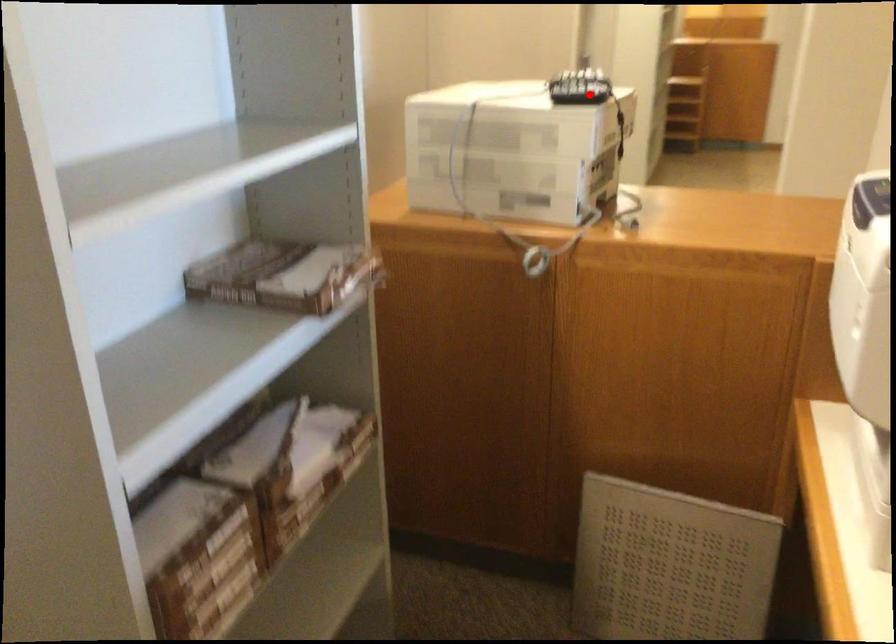
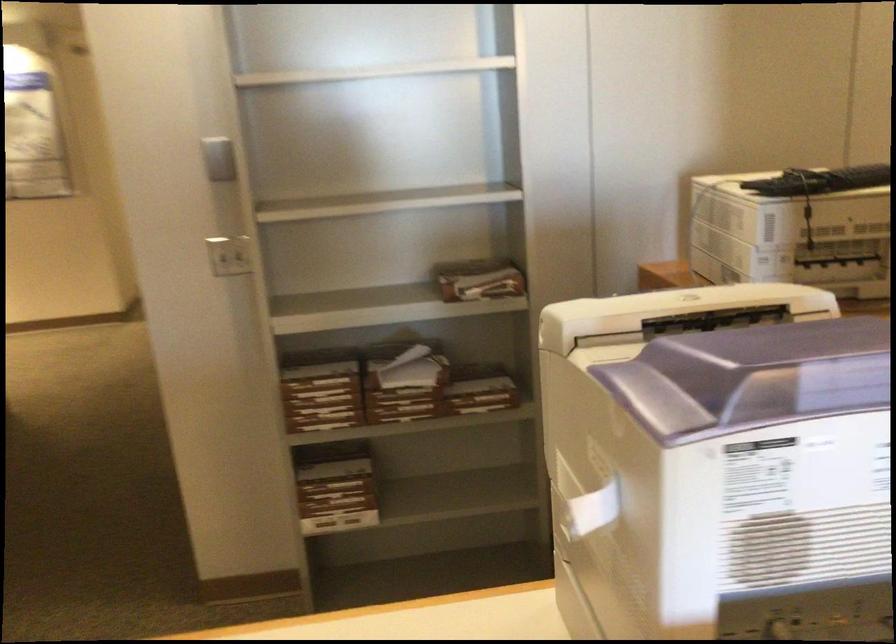
Where in the second image is the point corresponding to the highlighted location from the first image?

(820, 181)